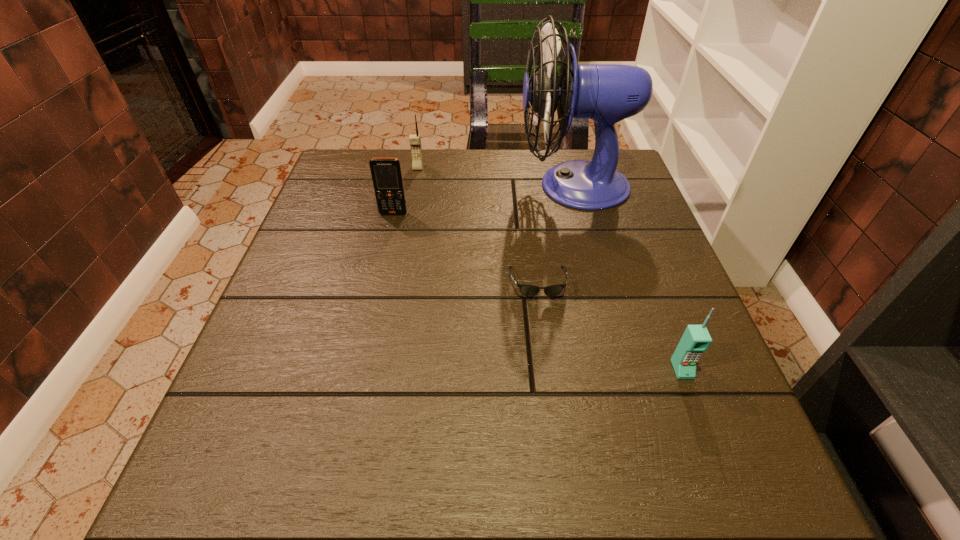
Image resolution: width=960 pixels, height=540 pixels. In order to click on free area in between the second farthest cellular telephone and the fan in this screenshot , I will do `click(484, 200)`.

This screenshot has height=540, width=960. Identify the location of unoccupied area between the farthest cellular telephone and the shortest object. (478, 225).

This screenshot has width=960, height=540. Find the location of `free space between the sunglasses and the tallest object`. free space between the sunglasses and the tallest object is located at coordinates (556, 234).

At what (x,y) coordinates should I click in order to perform the action: click on unoccupied area between the nearest cellular telephone and the farthest cellular telephone. Please return your answer as a coordinate pair (x, y). The height and width of the screenshot is (540, 960). Looking at the image, I should click on (550, 268).

Point out which object is positioned as the fourth nearest to the second farthest cellular telephone. Please provide its 2D coordinates. Your answer should be formatted as a tuple, i.e. [(x, y)], where the tuple contains the x and y coordinates of a point satisfying the conditions above.

[(696, 339)]

Identify which object is located as the third nearest to the tallest object. Please provide its 2D coordinates. Your answer should be formatted as a tuple, i.e. [(x, y)], where the tuple contains the x and y coordinates of a point satisfying the conditions above.

[(386, 173)]

At what (x,y) coordinates should I click in order to perform the action: click on cellular telephone that is the nearest to the tallest object. Please return your answer as a coordinate pair (x, y). Looking at the image, I should click on (414, 139).

Identify the location of the closest cellular telephone to the second farthest cellular telephone. (414, 139).

In order to click on free point that satisfies the following two spatial constraints: 1. in front of the tallest object where the airflow is directed; 2. on the front-facing side of the fourth farthest object in this screenshot , I will do `click(599, 284)`.

At what (x,y) coordinates should I click in order to perform the action: click on vacant region that satisfies the following two spatial constraints: 1. in front of the fan where the airflow is directed; 2. on the front-facing side of the second nearest object. Please return your answer as a coordinate pair (x, y). Looking at the image, I should click on (599, 284).